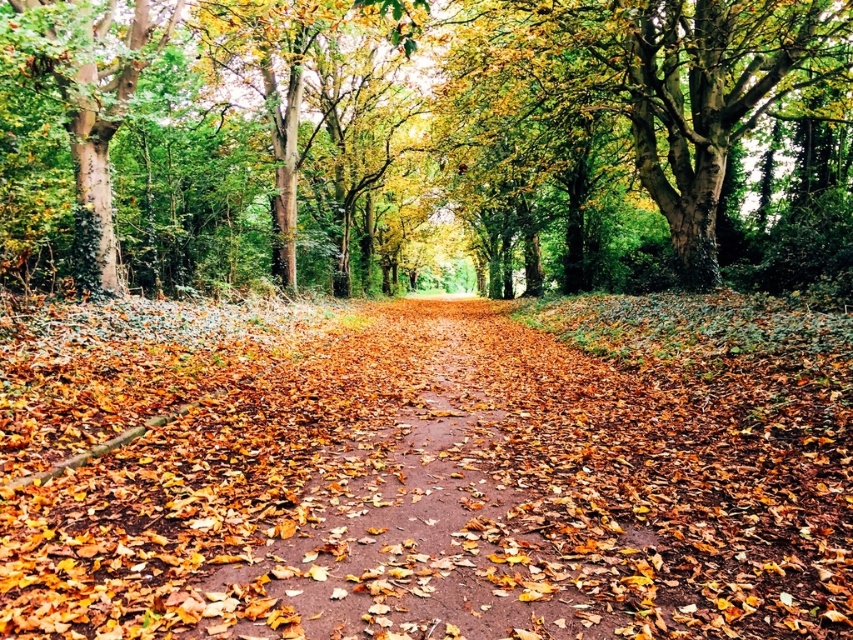
The width and height of the screenshot is (853, 640). What do you see at coordinates (469, 506) in the screenshot?
I see `brown dirt path at center` at bounding box center [469, 506].

Is brown dirt path at center bigger than green rough bark tree at left?

No, brown dirt path at center is not bigger than green rough bark tree at left.

Does point (666, 497) lie in front of point (79, 81)?

That is True.

This screenshot has height=640, width=853. I want to click on brown dirt path at center, so click(469, 506).

Who is taller, smooth bark tree at center or brown dirt path at center?

smooth bark tree at center

Is smooth bark tree at center shorter than brown dirt path at center?

No.

The height and width of the screenshot is (640, 853). Describe the element at coordinates (422, 141) in the screenshot. I see `smooth bark tree at center` at that location.

You are a GUI agent. You are given a task and a screenshot of the screen. Output one action in this format:
    pyautogui.click(x=<x>, y=<y>)
    Task: Click on the smooth bark tree at center
    Image resolution: width=853 pixels, height=640 pixels.
    Given the screenshot: What is the action you would take?
    pyautogui.click(x=422, y=141)

Looking at this image, is smooth bark tree at center wider than green rough bark tree at left?

Yes.

Which is in front, point (531, 141) or point (84, 243)?

Point (84, 243) is in front.

Between point (231, 83) and point (86, 92), which one is positioned behind?

Positioned behind is point (231, 83).

Identify the location of smooth bark tree at center. This screenshot has height=640, width=853. (422, 141).